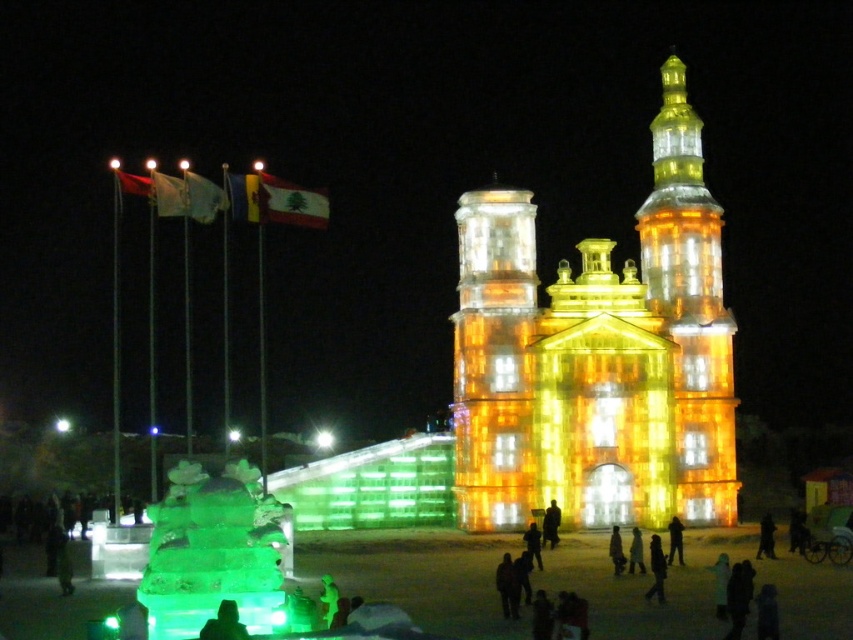
Question: Does illuminated ice sculpture at center appear on the left side of illuminated glass tower at upper right?

Choices:
 (A) yes
 (B) no

Answer: (A)

Question: Can you confirm if illuminated ice sculpture at center is bigger than illuminated glass tower at upper right?

Choices:
 (A) no
 (B) yes

Answer: (B)

Question: Considering the relative positions of illuminated ice sculpture at center and illuminated glass tower at upper right in the image provided, where is illuminated ice sculpture at center located with respect to illuminated glass tower at upper right?

Choices:
 (A) above
 (B) below

Answer: (B)

Question: Which is nearer to the illuminated ice sculpture at center?

Choices:
 (A) illuminated glass tower at upper right
 (B) illuminated ice tower at center

Answer: (A)

Question: Which is farther from the illuminated ice tower at center?

Choices:
 (A) illuminated ice sculpture at center
 (B) illuminated glass tower at upper right

Answer: (B)

Question: Which of the following is the closest to the observer?

Choices:
 (A) (505, 454)
 (B) (686, 324)

Answer: (A)